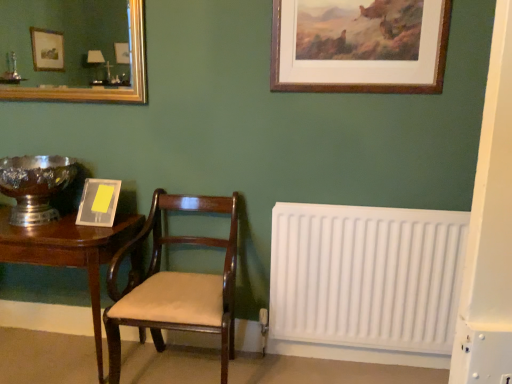
In order to face gold-framed mirror at upper left, should I rotate leftwards or rightwards?

A 23.986 degree turn to the left will do.

This screenshot has height=384, width=512. Find the location of `gold-framed mirror at upper left`. gold-framed mirror at upper left is located at coordinates (95, 87).

At what (x,y) coordinates should I click in order to perform the action: click on wooden picture frame at upper center, arranged as the 2th picture frame when viewed from the left. Please return your answer as a coordinate pair (x, y). Looking at the image, I should click on (359, 45).

What are the coordinates of `mahogany wood table at left` in the screenshot? It's located at (70, 252).

The image size is (512, 384). Describe the element at coordinates (98, 202) in the screenshot. I see `matte gray picture frame at left, the first picture frame positioned from the bottom` at that location.

Identify the location of white plastic radiator at lower right. This screenshot has height=384, width=512. (366, 276).

This screenshot has width=512, height=384. Identify the location of mahogany wood chair at center. (175, 285).

In the scene shown: From the image's perspective, which is below, matte gray picture frame at left, which ranks as the second picture frame in top-to-bottom order, or gold-framed mirror at upper left?

From the image's view, matte gray picture frame at left, which ranks as the second picture frame in top-to-bottom order, is below.

Is point (116, 180) closer to camera compared to point (28, 98)?

Yes.

Which of these two, matte gray picture frame at left, the second picture frame viewed from the right, or gold-framed mirror at upper left, is smaller?

matte gray picture frame at left, the second picture frame viewed from the right, is smaller.

Considering the sizes of objects mahogany wood table at left and white plastic radiator at lower right in the image provided, who is smaller, mahogany wood table at left or white plastic radiator at lower right?

white plastic radiator at lower right is smaller.

Is mahogany wood table at left not near white plastic radiator at lower right?

Yes, mahogany wood table at left is far from white plastic radiator at lower right.

Where is `radiator that appears behind the mahogany wood table at left`? Image resolution: width=512 pixels, height=384 pixels. radiator that appears behind the mahogany wood table at left is located at coordinates (366, 276).

Can you confirm if mahogany wood chair at center is wider than shiny silver bowl at left?

Yes, mahogany wood chair at center is wider than shiny silver bowl at left.

Does point (158, 208) lie in front of point (44, 173)?

That is False.

I want to click on glass bowl located behind the mahogany wood chair at center, so click(x=35, y=185).

Considering the sizes of objects mahogany wood chair at center and shiny silver bowl at left in the image provided, who is taller, mahogany wood chair at center or shiny silver bowl at left?

mahogany wood chair at center.

Based on the photo, is there a large distance between mahogany wood chair at center and wooden picture frame at upper center, arranged as the 2th picture frame when viewed from the left?

mahogany wood chair at center is actually quite close to wooden picture frame at upper center, arranged as the 2th picture frame when viewed from the left.

Considering the sizes of mahogany wood chair at center and wooden picture frame at upper center, the first picture frame positioned from the right, in the image, is mahogany wood chair at center wider or thinner than wooden picture frame at upper center, the first picture frame positioned from the right,?

In the image, mahogany wood chair at center appears to be wider than wooden picture frame at upper center, the first picture frame positioned from the right.

The height and width of the screenshot is (384, 512). I want to click on chair lying on the left of wooden picture frame at upper center, arranged as the 2th picture frame when viewed from the left, so click(175, 285).

Is white plastic radiator at lower right at the back of shiny silver bowl at left?

No, shiny silver bowl at left is not facing away from white plastic radiator at lower right.

Considering the positions of points (41, 193) and (445, 251), is point (41, 193) farther from camera compared to point (445, 251)?

Yes.

Between shiny silver bowl at left and white plastic radiator at lower right, which one appears on the left side from the viewer's perspective?

shiny silver bowl at left is more to the left.

At what (x,y) coordinates should I click in order to perform the action: click on glass bowl to the left of mahogany wood table at left. Please return your answer as a coordinate pair (x, y). Looking at the image, I should click on (35, 185).

Does mahogany wood table at left have a greater height compared to shiny silver bowl at left?

Yes.

From the image's perspective, which one is positioned lower, mahogany wood table at left or shiny silver bowl at left?

mahogany wood table at left.

Relative to shiny silver bowl at left, is mahogany wood table at left in front or behind?

mahogany wood table at left is positioned closer to the viewer than shiny silver bowl at left.

Can you tell me how much mahogany wood table at left and matte gray picture frame at left, the second picture frame viewed from the right, differ in facing direction?

0.000744 degrees separate the facing orientations of mahogany wood table at left and matte gray picture frame at left, the second picture frame viewed from the right.

From a real-world perspective, is mahogany wood table at left positioned under matte gray picture frame at left, acting as the 1th picture frame starting from the left, based on gravity?

Correct, in the physical world, mahogany wood table at left is lower than matte gray picture frame at left, acting as the 1th picture frame starting from the left.

Would you say mahogany wood table at left is inside or outside matte gray picture frame at left, the second picture frame viewed from the right?

mahogany wood table at left is spatially situated outside matte gray picture frame at left, the second picture frame viewed from the right.

From the image's perspective, would you say mahogany wood table at left is shown under matte gray picture frame at left, the first picture frame positioned from the bottom?

Yes.

From the gold-framed mirror at upper left, count 1st picture frame to the right and point to it. Please provide its 2D coordinates.

[(98, 202)]

Locate an element on the screen. The width and height of the screenshot is (512, 384). table located on the left of white plastic radiator at lower right is located at coordinates (70, 252).

When comparing their distances from wooden picture frame at upper center, the first picture frame positioned from the right, does mahogany wood chair at center or matte gray picture frame at left, the second picture frame viewed from the right, seem further?

The object further to wooden picture frame at upper center, the first picture frame positioned from the right, is matte gray picture frame at left, the second picture frame viewed from the right.

Which object lies nearer to the anchor point white plastic radiator at lower right, wooden picture frame at upper center, arranged as the 2th picture frame when viewed from the left, or shiny silver bowl at left?

wooden picture frame at upper center, arranged as the 2th picture frame when viewed from the left, is closer to white plastic radiator at lower right.

Looking at this image, considering their positions, is shiny silver bowl at left positioned further to wooden picture frame at upper center, the 1th picture frame in the top-to-bottom sequence, than gold-framed mirror at upper left?

Among the two, shiny silver bowl at left is located further to wooden picture frame at upper center, the 1th picture frame in the top-to-bottom sequence.

When comparing their distances from shiny silver bowl at left, does wooden picture frame at upper center, the first picture frame positioned from the right, or white plastic radiator at lower right seem further?

white plastic radiator at lower right is further to shiny silver bowl at left.

Considering their positions, is mahogany wood chair at center positioned further to gold-framed mirror at upper left than mahogany wood table at left?

The object further to gold-framed mirror at upper left is mahogany wood chair at center.

From the image, which object appears to be nearer to mahogany wood table at left, shiny silver bowl at left or white plastic radiator at lower right?

shiny silver bowl at left is closer to mahogany wood table at left.

Estimate the real-world distances between objects in this image. Which object is closer to white plastic radiator at lower right, gold-framed mirror at upper left or shiny silver bowl at left?

gold-framed mirror at upper left is positioned closer to the anchor white plastic radiator at lower right.

Considering their positions, is mahogany wood table at left positioned closer to gold-framed mirror at upper left than white plastic radiator at lower right?

mahogany wood table at left is closer to gold-framed mirror at upper left.

Identify the location of picture frame between mahogany wood table at left and wooden picture frame at upper center, the first picture frame positioned from the right, in the horizontal direction. Image resolution: width=512 pixels, height=384 pixels. (98, 202).

Locate an element on the screen. mirror between shiny silver bowl at left and white plastic radiator at lower right in the horizontal direction is located at coordinates (95, 87).

Image resolution: width=512 pixels, height=384 pixels. I want to click on picture frame between shiny silver bowl at left and mahogany wood table at left in the vertical direction, so click(98, 202).

Find the location of a particular element. The image size is (512, 384). picture frame between shiny silver bowl at left and wooden picture frame at upper center, the first picture frame positioned from the right is located at coordinates (98, 202).